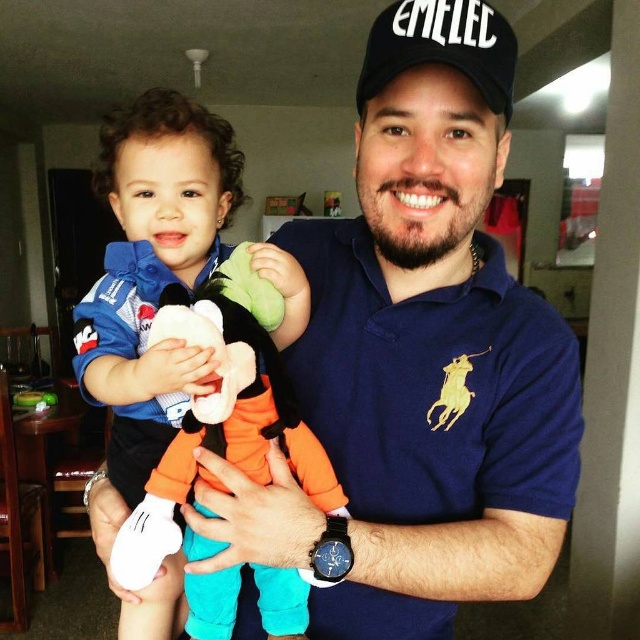
Question: Does soft plush toy at center have a smaller size compared to black fabric cap at upper center?

Choices:
 (A) yes
 (B) no

Answer: (B)

Question: Which object is closer to the camera taking this photo?

Choices:
 (A) black fabric cap at upper center
 (B) soft plush toy at center

Answer: (A)

Question: Is soft plush toy at center below black fabric cap at upper center?

Choices:
 (A) no
 (B) yes

Answer: (B)

Question: Can you confirm if soft plush toy at center is positioned below black fabric cap at upper center?

Choices:
 (A) no
 (B) yes

Answer: (B)